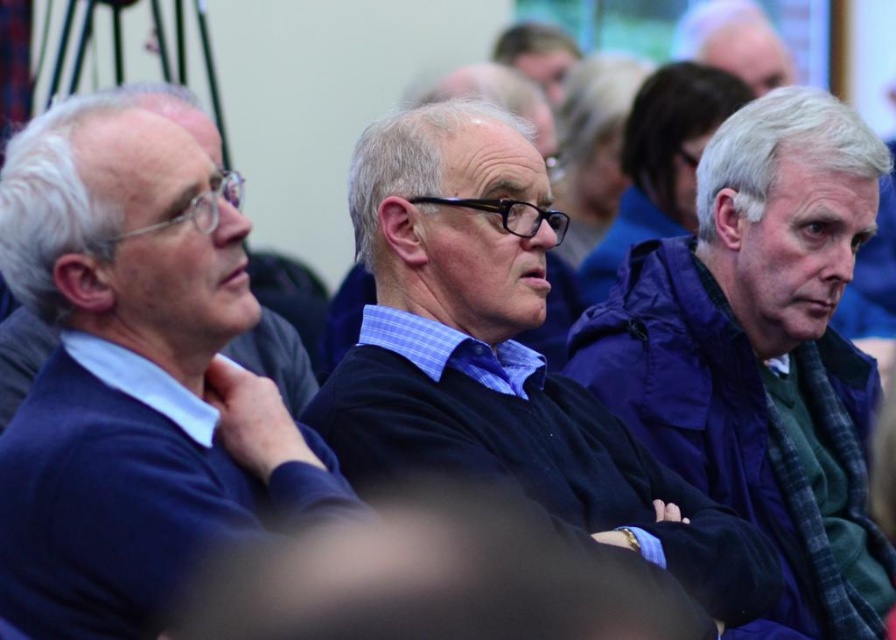
Between point (621, 381) and point (520, 42), which one is positioned in front?

Point (621, 381) is more forward.

Who is lower down, purple fabric jacket at right or smooth skin face at upper center?

purple fabric jacket at right is lower down.

Does point (729, 278) lie behind point (553, 52)?

No, it is not.

What are the coordinates of `purple fabric jacket at right` in the screenshot? It's located at (762, 349).

Is black matte sweater at center positioned before dark blue sweater at center?

Yes, it is in front of dark blue sweater at center.

Between black matte sweater at center and dark blue sweater at center, which one is positioned lower?

black matte sweater at center

I want to click on black matte sweater at center, so click(501, 356).

Is the position of purple fabric jacket at right more distant than that of dark blue sweater at center?

No, purple fabric jacket at right is in front of dark blue sweater at center.

This screenshot has width=896, height=640. I want to click on purple fabric jacket at right, so click(x=762, y=349).

Locate an element on the screen. The height and width of the screenshot is (640, 896). purple fabric jacket at right is located at coordinates (762, 349).